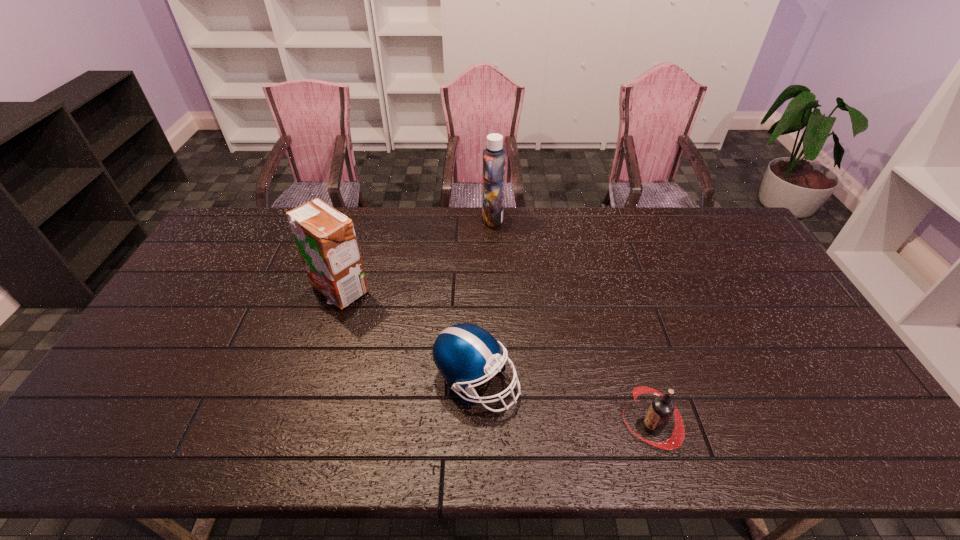
Point out which object is positioned as the second nearest to the leftmost object. Please provide its 2D coordinates. Your answer should be formatted as a tuple, i.e. [(x, y)], where the tuple contains the x and y coordinates of a point satisfying the conditions above.

[(494, 156)]

Point out which object is positioned as the nearest to the shampoo. Please provide its 2D coordinates. Your answer should be formatted as a tuple, i.e. [(x, y)], where the tuple contains the x and y coordinates of a point satisfying the conditions above.

[(326, 240)]

Locate an element on the screen. The image size is (960, 540). vacant space that satisfies the following two spatial constraints: 1. on the front label of the shampoo; 2. on the straw side of the carton is located at coordinates (495, 290).